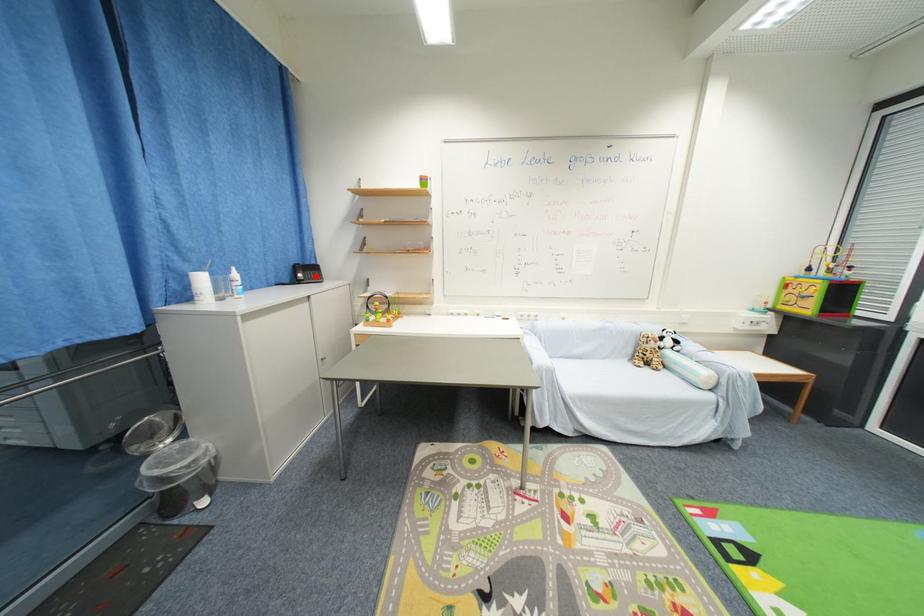
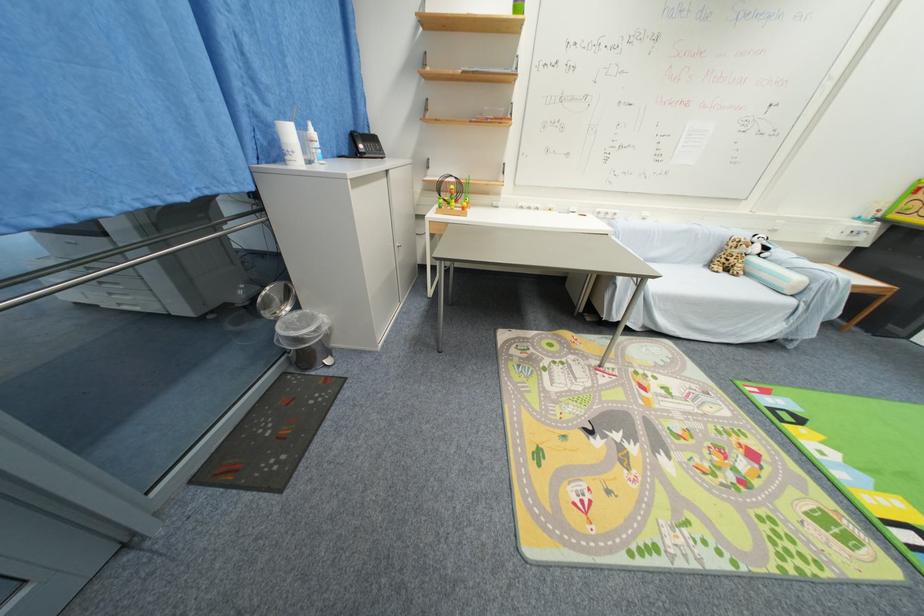
Find the pixel in the second image that matches the highlighted location in the first image.

(377, 148)